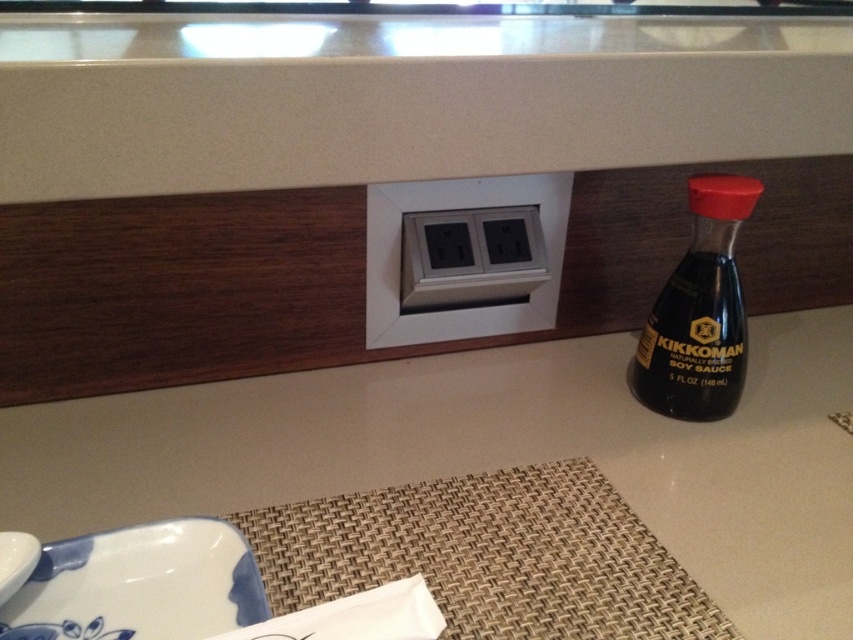
Does white plastic electrical outlet at center have a lesser height compared to white glossy plate at lower left?

No.

Between point (410, 307) and point (4, 536), which one is positioned in front?

Point (4, 536)

Locate an element on the screen. white plastic electrical outlet at center is located at coordinates (463, 257).

Measure the distance between woven beige placemat at lower center and camera.

woven beige placemat at lower center and camera are 15.39 inches apart.

Does woven beige placemat at lower center have a larger size compared to black glass bottle at right?

No.

What do you see at coordinates (489, 556) in the screenshot?
I see `woven beige placemat at lower center` at bounding box center [489, 556].

Locate an element on the screen. This screenshot has height=640, width=853. woven beige placemat at lower center is located at coordinates (489, 556).

Can you confirm if dark wood drawer at upper left is positioned above white glossy plate at lower left?

Yes.

Is point (88, 294) positioned after point (26, 538)?

That is True.

The width and height of the screenshot is (853, 640). In order to click on dark wood drawer at upper left in this screenshot , I will do `click(177, 289)`.